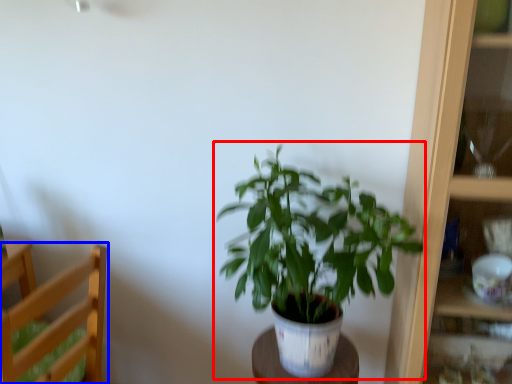
Question: Which object appears closest to the camera in this image, houseplant (highlighted by a red box) or furniture (highlighted by a blue box)?

Choices:
 (A) houseplant
 (B) furniture

Answer: (A)